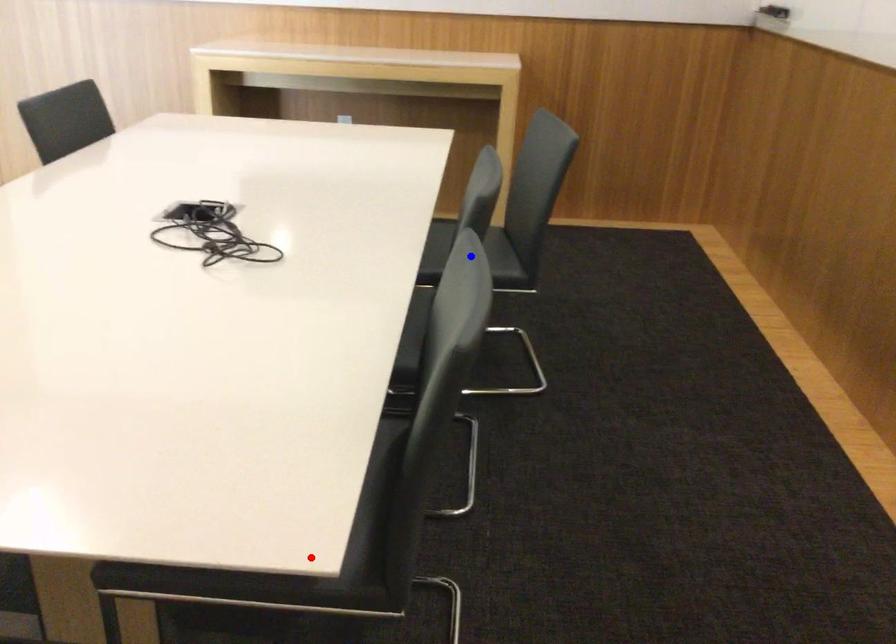
Question: Which of the two points in the image is closer to the camera?

Choices:
 (A) Blue point is closer.
 (B) Red point is closer.

Answer: (B)